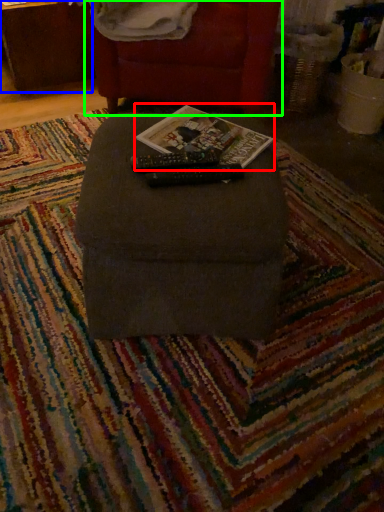
Question: Which object is the farthest from magazine (highlighted by a red box)? Choose among these: table (highlighted by a blue box) or furniture (highlighted by a green box).

Choices:
 (A) table
 (B) furniture

Answer: (A)